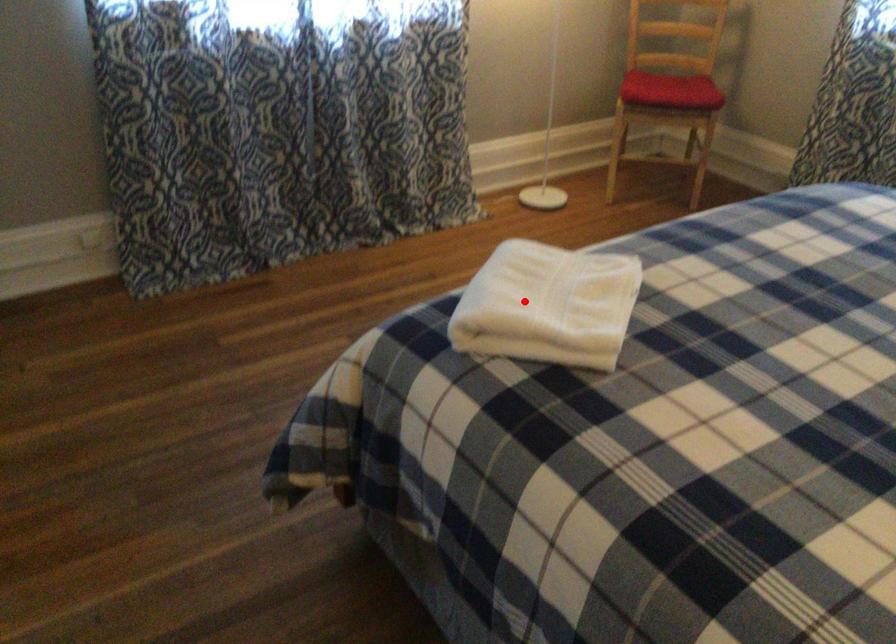
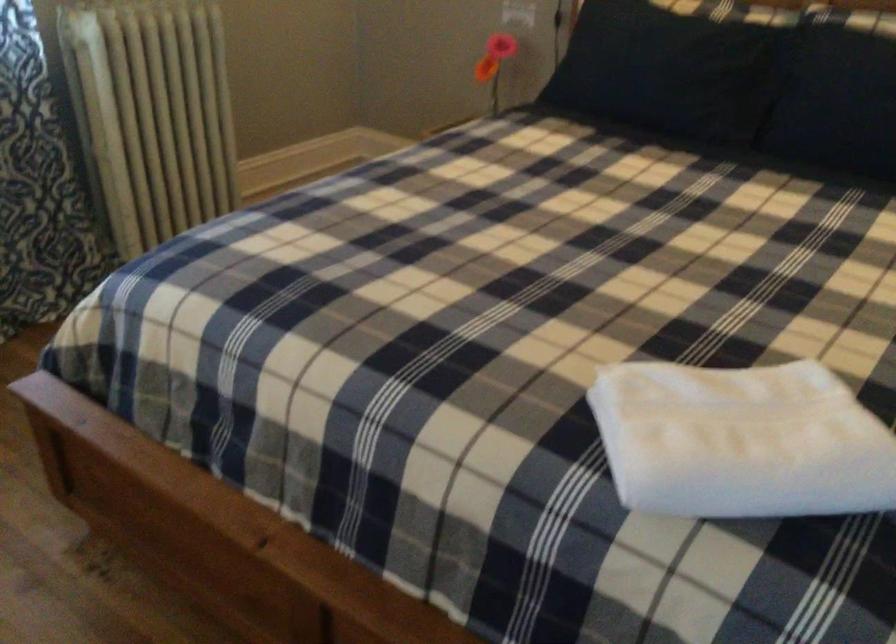
Question: I am providing you with two images of the same scene from different viewpoints. Given a red point in image1, look at the same physical point in image2. Is it:

Choices:
 (A) Closer to the viewpoint
 (B) Farther from the viewpoint

Answer: (A)